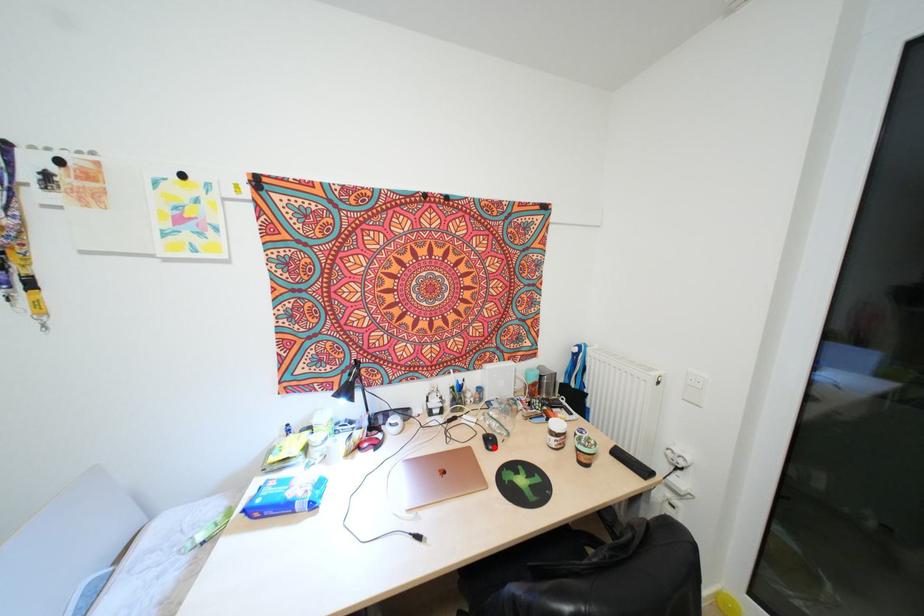
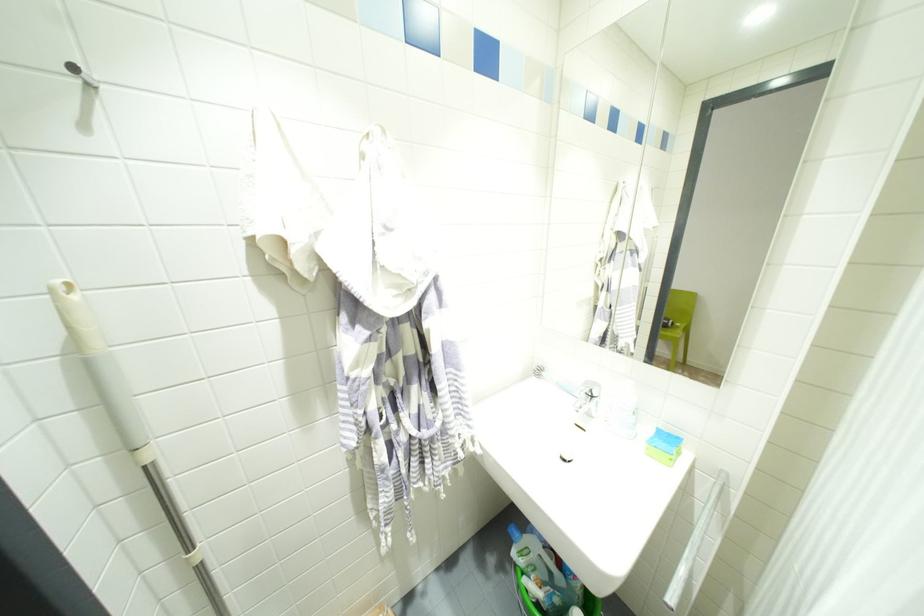
Question: I am providing you with two images of the same scene from different viewpoints. A red point is marked on the first image. At the location where the point appears in image 1, is it still visible in image 2?

Choices:
 (A) Yes
 (B) No

Answer: (B)